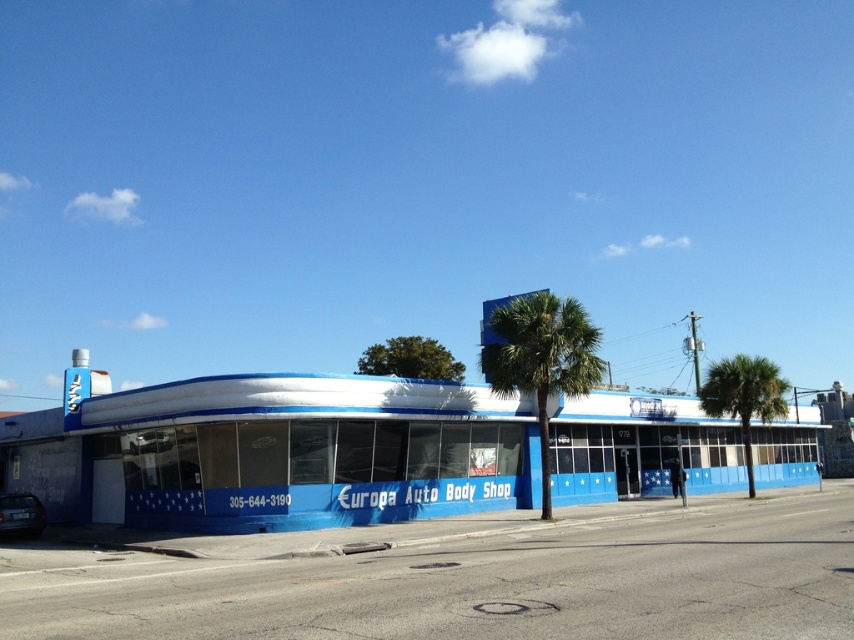
Measure the distance from green leafy palm tree at center to shiny black car at lower left.

The distance of green leafy palm tree at center from shiny black car at lower left is 16.35 meters.

Is green leafy palm tree at center to the right of shiny black car at lower left from the viewer's perspective?

Yes, green leafy palm tree at center is to the right of shiny black car at lower left.

The width and height of the screenshot is (854, 640). Describe the element at coordinates (541, 356) in the screenshot. I see `green leafy palm tree at center` at that location.

Find the location of a particular element. This screenshot has width=854, height=640. green leafy palm tree at center is located at coordinates tap(541, 356).

Who is shorter, green leafy palm tree at right or shiny black car at lower left?

Standing shorter between the two is shiny black car at lower left.

Which is below, green leafy palm tree at right or shiny black car at lower left?

Positioned lower is green leafy palm tree at right.

Is point (724, 394) closer to viewer compared to point (22, 492)?

No, (724, 394) is behind (22, 492).

Find the location of a particular element. green leafy palm tree at right is located at coordinates (744, 396).

Can you confirm if green leafy palm tree at center is taller than green leafy palm tree at right?

Yes.

Can you confirm if green leafy palm tree at center is positioned above green leafy palm tree at right?

Yes.

At what (x,y) coordinates should I click in order to perform the action: click on green leafy palm tree at center. Please return your answer as a coordinate pair (x, y). Looking at the image, I should click on (541, 356).